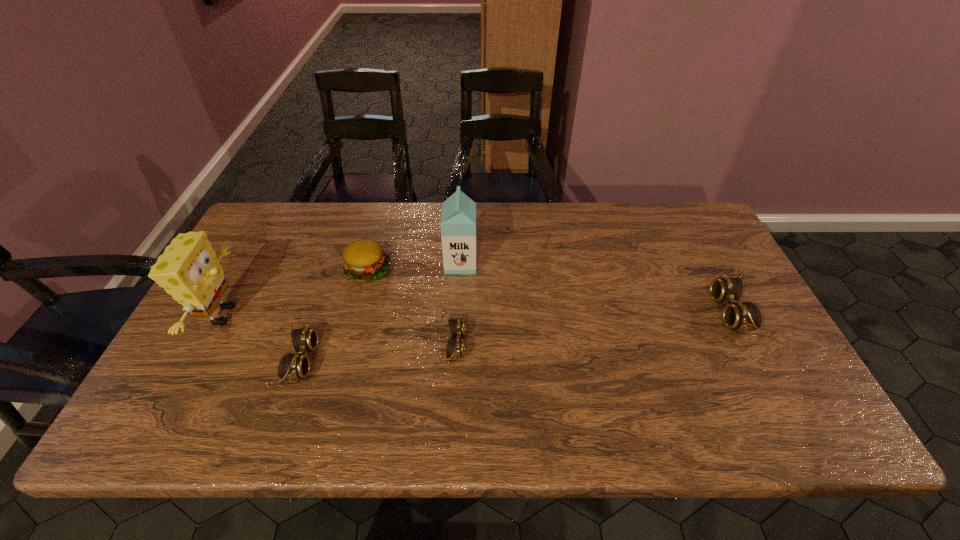
Identify the location of free spot between the rightmost goggles and the second tallest goggles. Image resolution: width=960 pixels, height=540 pixels. (516, 338).

This screenshot has height=540, width=960. I want to click on free spot between the leftmost object and the rightmost object, so 478,314.

Find the location of a particular element. The height and width of the screenshot is (540, 960). free spot between the milk carton and the shortest goggles is located at coordinates (457, 304).

Where is `blank region between the sponge and the hamburger`? blank region between the sponge and the hamburger is located at coordinates 295,293.

I want to click on empty space between the milk carton and the third object from left to right, so click(x=414, y=267).

Identify which object is the second closest to the second goggles from right to left. Please provide its 2D coordinates. Your answer should be formatted as a tuple, i.e. [(x, y)], where the tuple contains the x and y coordinates of a point satisfying the conditions above.

[(365, 260)]

Find the location of a particular element. The width and height of the screenshot is (960, 540). object that is the fourth closest to the second shortest goggles is located at coordinates (458, 218).

This screenshot has height=540, width=960. I want to click on the third closest goggles relative to the sponge, so click(746, 316).

Select which goggles appears as the second closest to the rightmost goggles. Please provide its 2D coordinates. Your answer should be formatted as a tuple, i.e. [(x, y)], where the tuple contains the x and y coordinates of a point satisfying the conditions above.

[(292, 366)]

Locate an element on the screen. The height and width of the screenshot is (540, 960). vacant space that satisfies the following two spatial constraints: 1. on the front side of the milk carton; 2. on the face of the sponge is located at coordinates (458, 315).